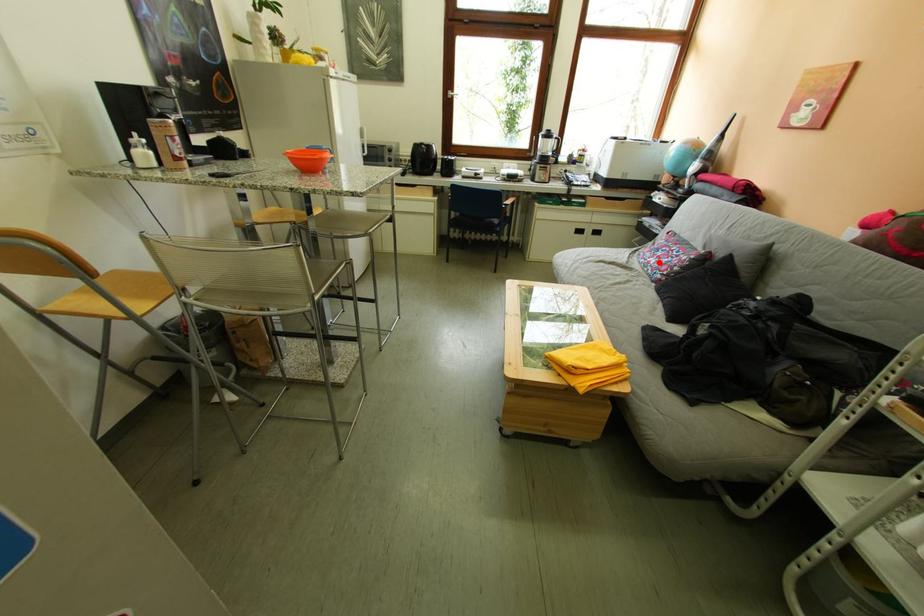
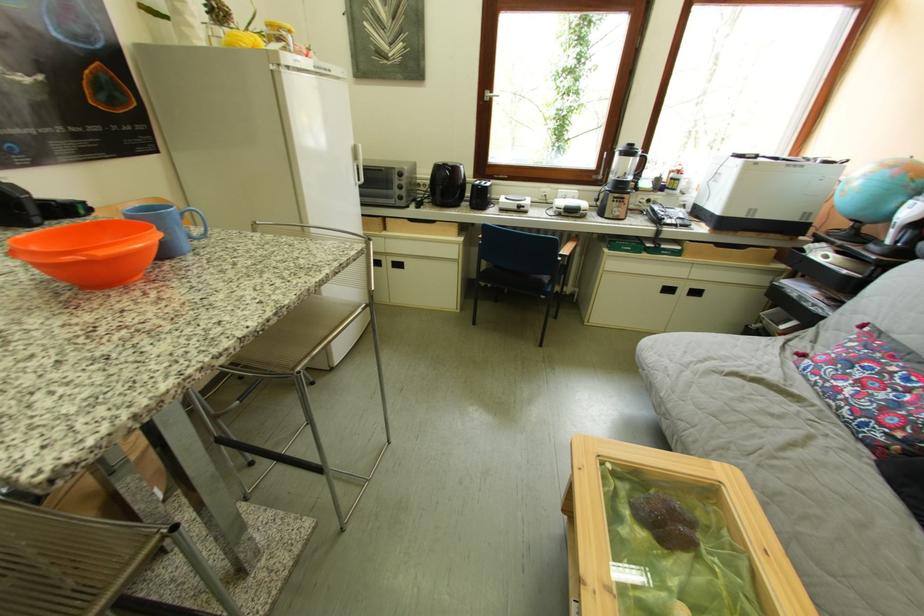
Question: I am providing you with two images of the same scene from different viewpoints. A red point is shown in image1. For the corresponding object point in image2, is it positioned nearer or farther from the camera?

Choices:
 (A) Nearer
 (B) Farther

Answer: (B)